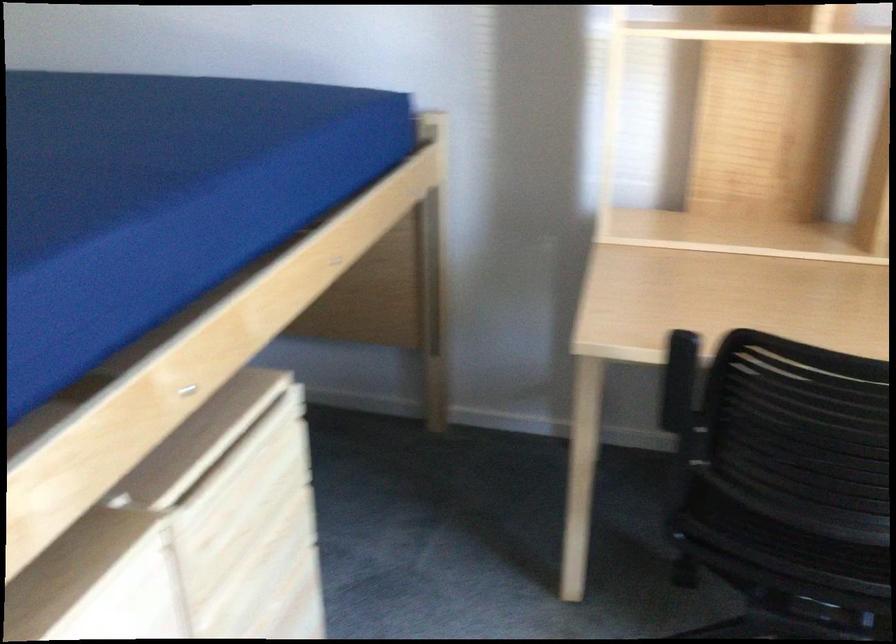
Locate an element on the screen. The height and width of the screenshot is (644, 896). wooden drawer top is located at coordinates (202, 439).